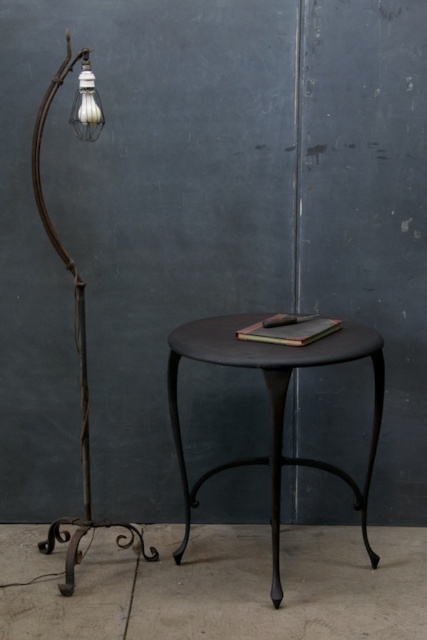
Who is positioned more to the left, matte black table at center or rustic wrought iron floor lamp at left?

rustic wrought iron floor lamp at left is more to the left.

Is matte black table at center to the right of rustic wrought iron floor lamp at left from the viewer's perspective?

Yes, matte black table at center is to the right of rustic wrought iron floor lamp at left.

Is point (271, 432) behind point (82, 83)?

That is True.

You are a GUI agent. You are given a task and a screenshot of the screen. Output one action in this format:
    pyautogui.click(x=<x>, y=<y>)
    Task: Click on the matte black table at center
    The width and height of the screenshot is (427, 640).
    Given the screenshot: What is the action you would take?
    pyautogui.click(x=272, y=404)

Between matte black table at center and matte white bulb at upper left, which one is positioned higher?

matte white bulb at upper left

Who is positioned more to the right, matte black table at center or matte white bulb at upper left?

matte black table at center

Does point (231, 349) lie behind point (81, 81)?

No, (231, 349) is closer to viewer.

Find the location of `matte black table at center`. matte black table at center is located at coordinates (272, 404).

Is point (90, 520) more distant than point (85, 52)?

Yes, point (90, 520) is farther from viewer.

Can you confirm if rustic wrought iron floor lamp at left is shorter than matte white bulb at upper left?

No, rustic wrought iron floor lamp at left is not shorter than matte white bulb at upper left.

Is point (38, 541) behind point (85, 67)?

Yes.

You are a GUI agent. You are given a task and a screenshot of the screen. Output one action in this format:
    pyautogui.click(x=<x>, y=<y>)
    Task: Click on the rustic wrought iron floor lamp at left
    Image resolution: width=427 pixels, height=640 pixels.
    Given the screenshot: What is the action you would take?
    pyautogui.click(x=76, y=305)